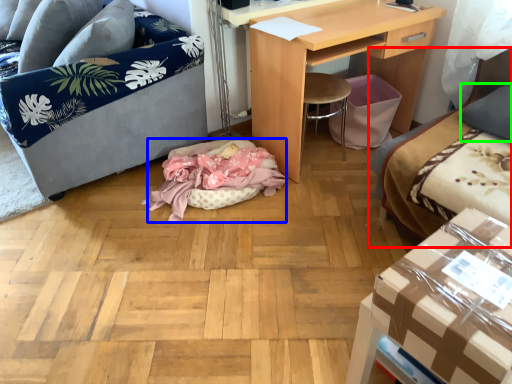
Question: Based on their relative distances, which object is nearer to studio couch (highlighted by a red box)? Choose from cat bed (highlighted by a blue box) and pillow (highlighted by a green box).

Choices:
 (A) cat bed
 (B) pillow

Answer: (B)